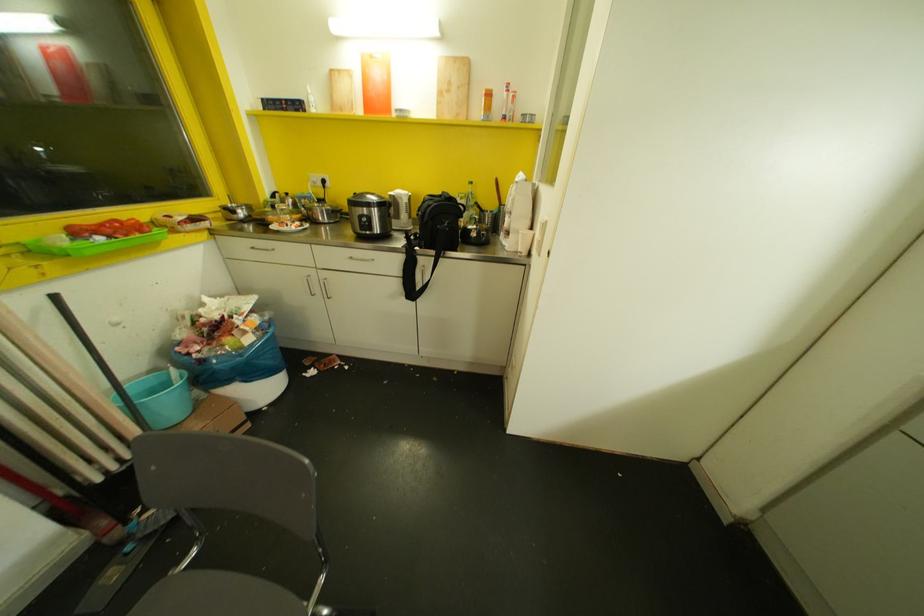
Identify the location of black bag strap. The width and height of the screenshot is (924, 616). (439, 220).